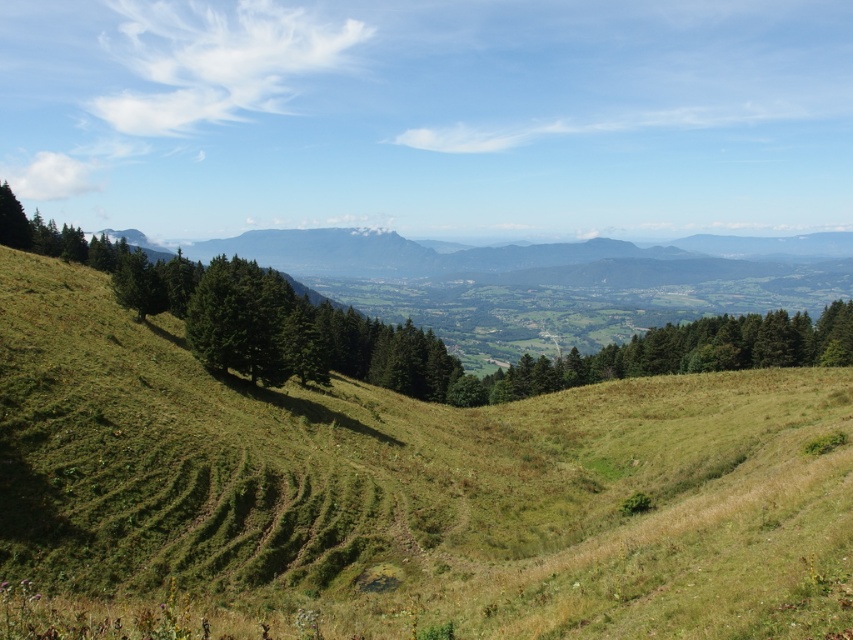
Question: Is green grassy hillside at center to the left of green matte tree at left from the viewer's perspective?

Choices:
 (A) no
 (B) yes

Answer: (B)

Question: Which of the following is the farthest from the observer?

Choices:
 (A) green grassy hillside at center
 (B) green matte tree at left

Answer: (B)

Question: Among these points, which one is nearest to the camera?

Choices:
 (A) pos(248,272)
 (B) pos(833,589)

Answer: (B)

Question: Which object is closer to the camera taking this photo?

Choices:
 (A) green grassy hillside at center
 (B) green matte tree at left

Answer: (A)

Question: Does green grassy hillside at center have a smaller size compared to green matte tree at left?

Choices:
 (A) yes
 (B) no

Answer: (A)

Question: Is green grassy hillside at center smaller than green matte tree at left?

Choices:
 (A) yes
 (B) no

Answer: (A)